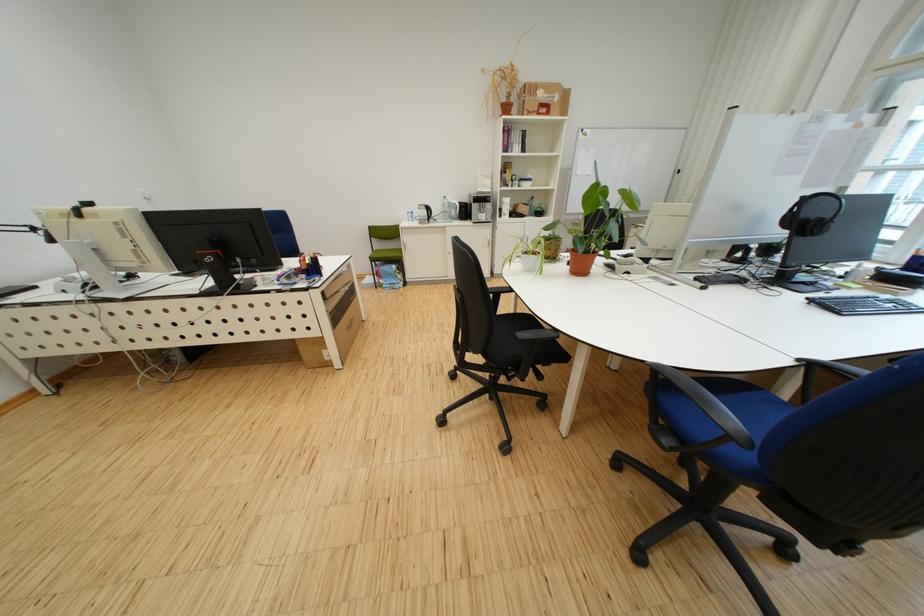
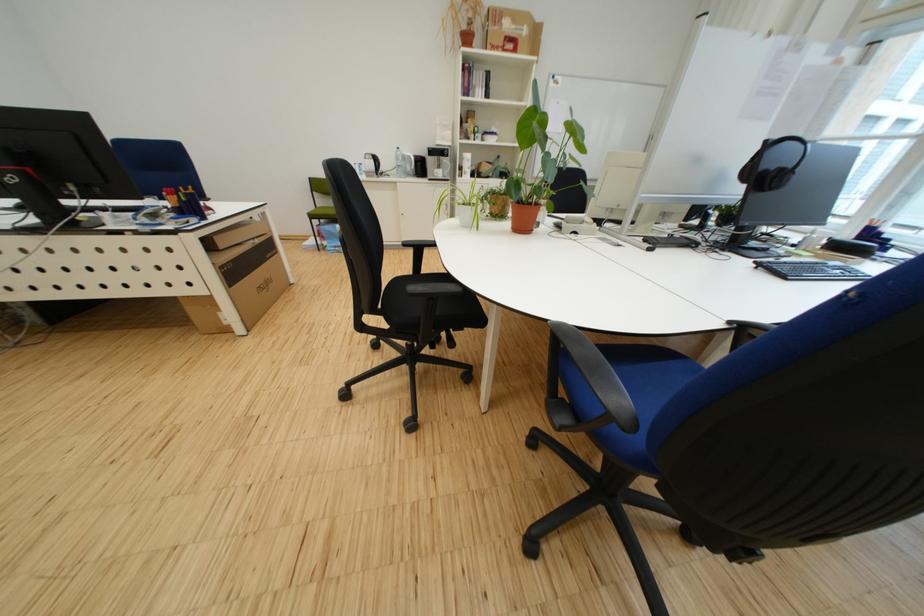
The point at [824,302] is marked in the first image. Where is the corresponding point in the second image?

(772, 268)